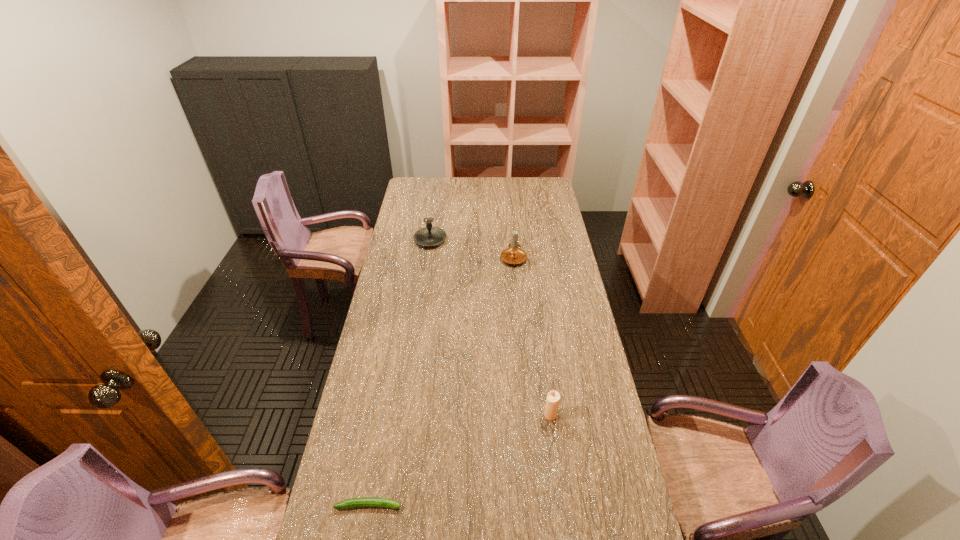
This screenshot has height=540, width=960. Find the location of `free space located 0.130m on the front-facing side of the nearest object`. free space located 0.130m on the front-facing side of the nearest object is located at coordinates (451, 505).

The image size is (960, 540). In order to click on candle that is at the left edge in this screenshot , I will do `click(429, 236)`.

This screenshot has width=960, height=540. What are the coordinates of `zucchini located in the left edge section of the desktop` in the screenshot? It's located at (363, 501).

In order to click on object that is at the right edge in this screenshot , I will do `click(553, 398)`.

Find the location of a particular element. The width and height of the screenshot is (960, 540). free space at the far edge of the desktop is located at coordinates (511, 184).

Where is `vacant space at the left edge`? The height and width of the screenshot is (540, 960). vacant space at the left edge is located at coordinates (400, 281).

You are a GUI agent. You are given a task and a screenshot of the screen. Output one action in this format:
    pyautogui.click(x=<x>, y=<y>)
    Task: Click on the vacant space at the right edge of the desktop
    
    Given the screenshot: What is the action you would take?
    pyautogui.click(x=595, y=350)

Image resolution: width=960 pixels, height=540 pixels. Find the location of `free location at the far left corner`. free location at the far left corner is located at coordinates (419, 183).

Find the location of a particular element. This screenshot has height=540, width=960. free spot between the leftmost candle and the third nearest object is located at coordinates (473, 249).

At what (x,y) coordinates should I click in order to perform the action: click on vacant space in between the second shortest object and the shortest object. Please return your answer as a coordinate pair (x, y). Looking at the image, I should click on (460, 460).